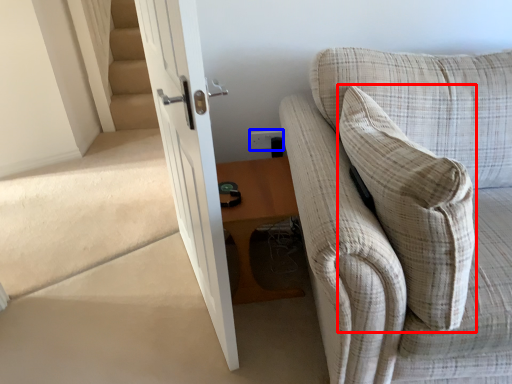
Question: Which object appears farthest to the camera in this image, throw pillow (highlighted by a red box) or electric outlet (highlighted by a blue box)?

Choices:
 (A) throw pillow
 (B) electric outlet

Answer: (B)